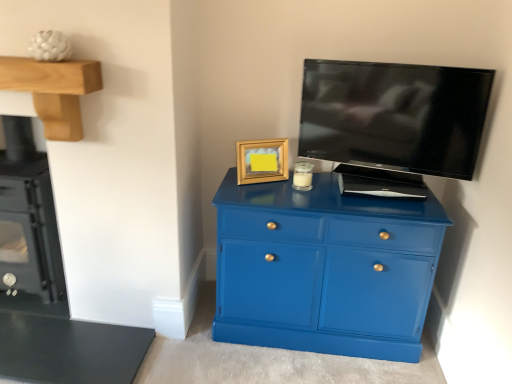
I want to click on vacant space underneath wooden mantel at upper left (from a real-world perspective), so click(x=73, y=324).